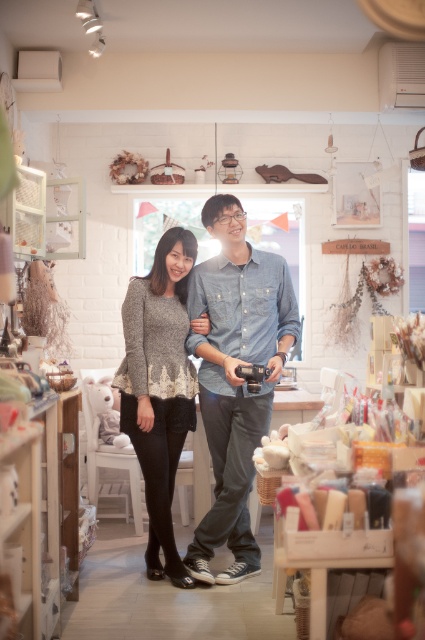
Is denim shirt at center positioned behind knitted gray sweater at center?

No.

Can you confirm if denim shirt at center is positioned to the left of knitted gray sweater at center?

Incorrect, denim shirt at center is not on the left side of knitted gray sweater at center.

Is point (254, 276) positioned behind point (136, 353)?

No, it is in front of (136, 353).

Where is `denim shirt at center`? This screenshot has width=425, height=640. denim shirt at center is located at coordinates (235, 376).